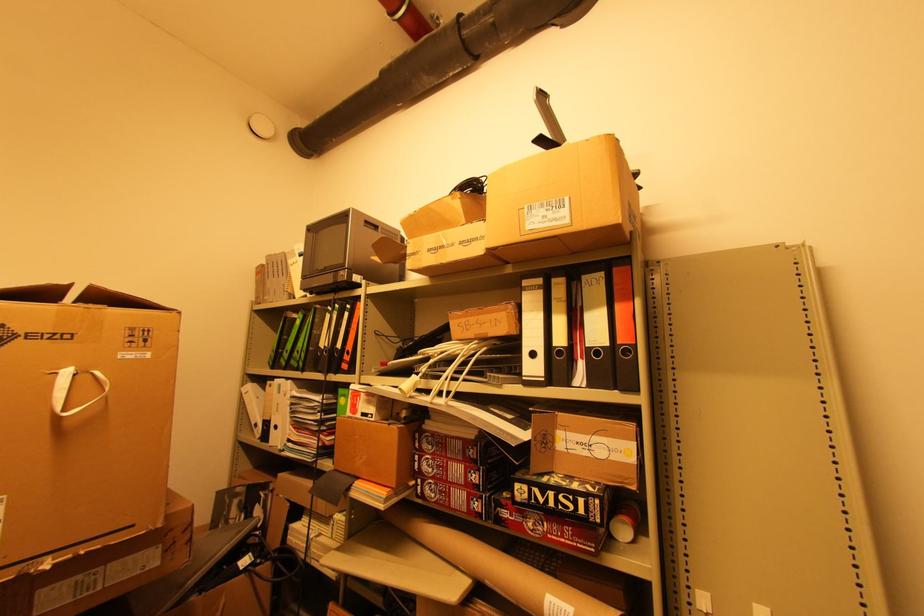
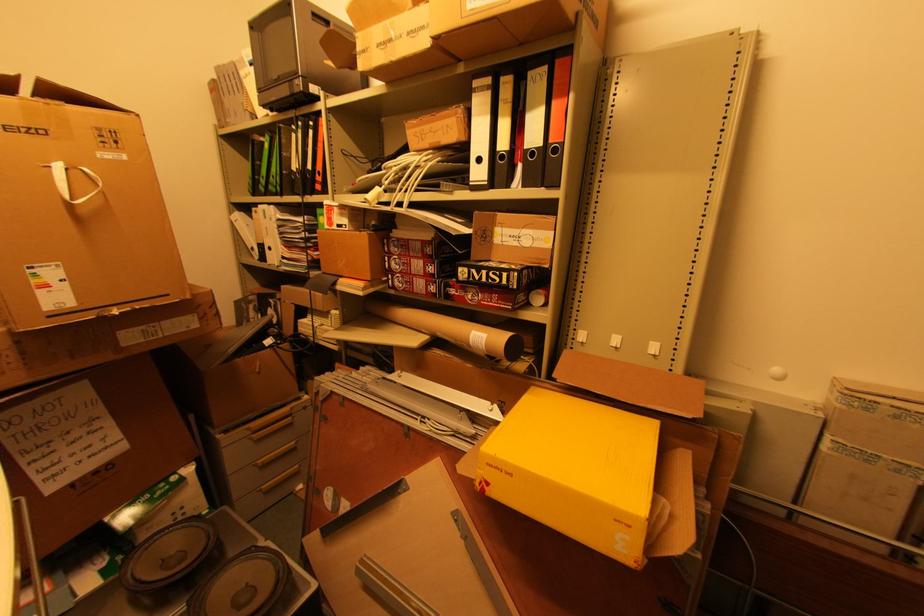
Question: The first image is from the beginning of the video and the second image is from the end. How did the camera likely rotate when shooting the video?

Choices:
 (A) Left
 (B) Right
 (C) Up
 (D) Down

Answer: (D)